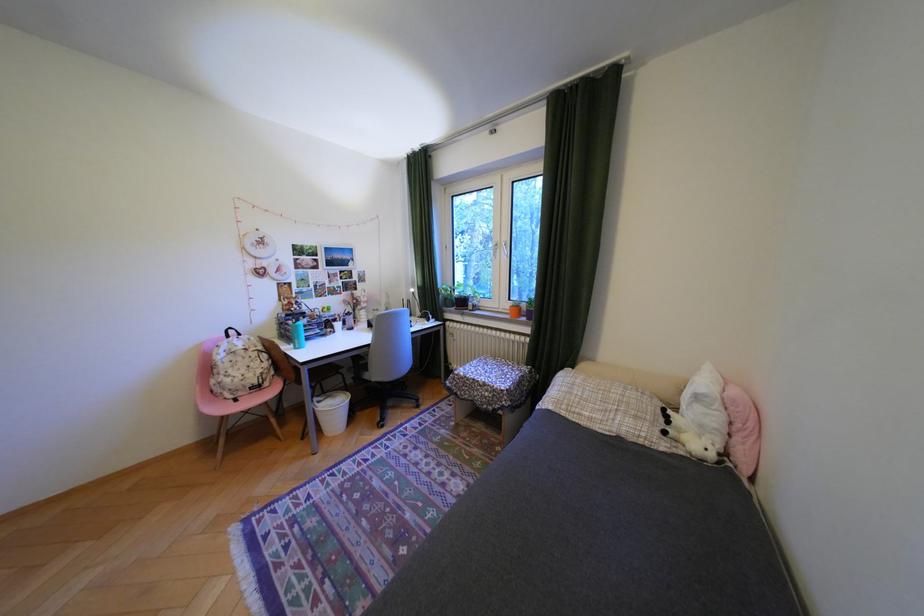
This screenshot has height=616, width=924. Find the location of `desk organizer tray`. desk organizer tray is located at coordinates (492, 391).